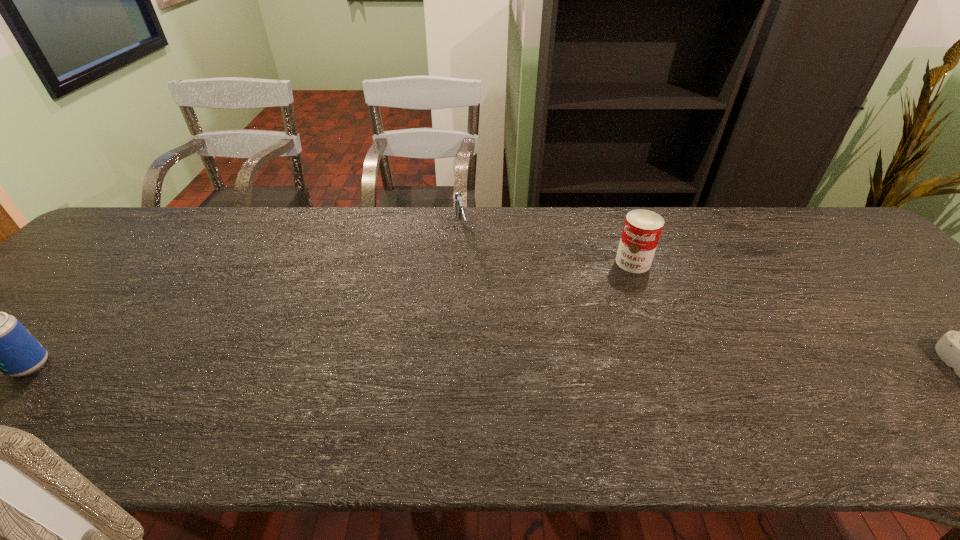
This screenshot has height=540, width=960. In order to click on the third object from right to left in this screenshot , I will do `click(459, 208)`.

At what (x,y) coordinates should I click in order to perform the action: click on the second shortest object. Please return your answer as a coordinate pair (x, y). Image resolution: width=960 pixels, height=540 pixels. Looking at the image, I should click on (459, 208).

Locate an element on the screen. The width and height of the screenshot is (960, 540). the second farthest object is located at coordinates (642, 228).

Where is `the third object from left to right`? The image size is (960, 540). the third object from left to right is located at coordinates (642, 228).

The width and height of the screenshot is (960, 540). Find the location of `free spot located 0.250m at the barrel of the second shortest object`. free spot located 0.250m at the barrel of the second shortest object is located at coordinates (x=475, y=313).

At what (x,y) coordinates should I click in order to perform the action: click on vacant space located 0.230m at the barrel of the second shortest object. Please return your answer as a coordinate pair (x, y). Image resolution: width=960 pixels, height=540 pixels. Looking at the image, I should click on (474, 307).

This screenshot has width=960, height=540. In order to click on free spot located at the barrel of the second shortest object in this screenshot , I will do `click(474, 310)`.

Where is `free point located 0.220m on the front label of the second farthest object`? free point located 0.220m on the front label of the second farthest object is located at coordinates (583, 315).

The height and width of the screenshot is (540, 960). Identify the location of vacant space located on the front label of the second farthest object. (553, 347).

The height and width of the screenshot is (540, 960). I want to click on vacant area situated 0.320m on the front label of the second farthest object, so click(x=561, y=339).